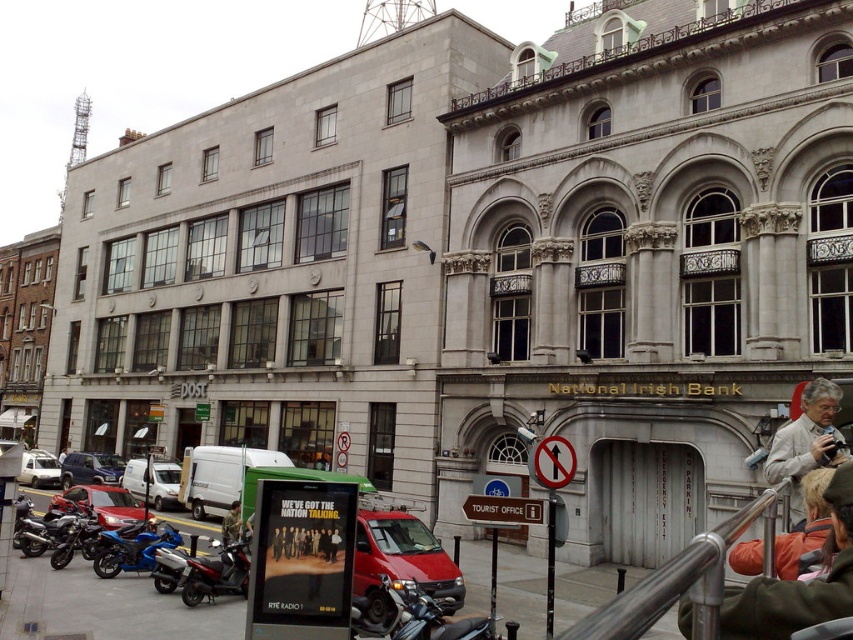
Question: Which of the following is the farthest from the observer?

Choices:
 (A) brushed metal motorcycle at lower left
 (B) metallic silver sign at center

Answer: (A)

Question: Can you confirm if orange jacket at lower right is positioned to the left of metallic silver scooter at center?

Choices:
 (A) yes
 (B) no

Answer: (B)

Question: Which point appears closest to the camera in this image?

Choices:
 (A) (138, 540)
 (B) (410, 596)

Answer: (B)

Question: Does light beige fabric jacket at right have a smaller size compared to metallic silver scooter at lower center?

Choices:
 (A) no
 (B) yes

Answer: (A)

Question: Can you confirm if metallic silver scooter at lower center is thinner than metallic silver sign at center?

Choices:
 (A) yes
 (B) no

Answer: (B)

Question: Which point appears farthest from the camera in this image?

Choices:
 (A) (514, 515)
 (B) (61, 513)

Answer: (B)